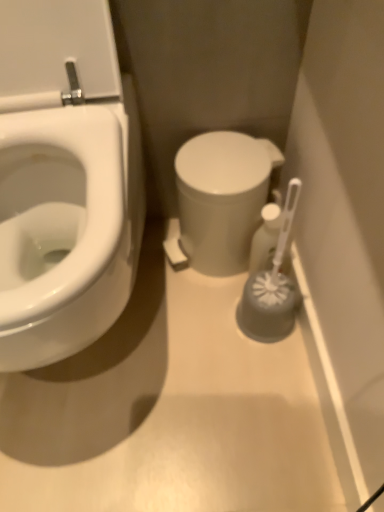
I want to click on free location above white glossy toilet at center (from a real-world perspective), so click(x=223, y=159).